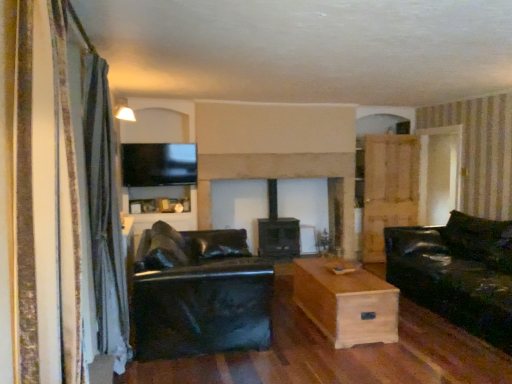
Question: Can you confirm if light brown wood armoire at right is smaller than gray fabric curtain at left, the first curtain viewed from the back?

Choices:
 (A) yes
 (B) no

Answer: (A)

Question: Is light brown wood armoire at right outside of gray fabric curtain at left, the 2th curtain positioned from the front?

Choices:
 (A) yes
 (B) no

Answer: (A)

Question: From the image's perspective, is light brown wood armoire at right below gray fabric curtain at left, which appears as the second curtain when viewed from the right?

Choices:
 (A) yes
 (B) no

Answer: (B)

Question: Is light brown wood armoire at right positioned with its back to gray fabric curtain at left, the 2th curtain positioned from the front?

Choices:
 (A) yes
 (B) no

Answer: (B)

Question: From a real-world perspective, does light brown wood armoire at right stand above gray fabric curtain at left, the first curtain viewed from the back?

Choices:
 (A) no
 (B) yes

Answer: (A)

Question: Considering the positions of point (444, 163) and point (380, 321), is point (444, 163) closer or farther from the camera than point (380, 321)?

Choices:
 (A) closer
 (B) farther

Answer: (B)

Question: Do you think transparent glass door at upper right is within light brown wood coffee table at center, or outside of it?

Choices:
 (A) inside
 (B) outside

Answer: (B)

Question: From the image's perspective, relative to light brown wood coffee table at center, is transparent glass door at upper right above or below?

Choices:
 (A) above
 (B) below

Answer: (A)

Question: In terms of height, does transparent glass door at upper right look taller or shorter compared to light brown wood coffee table at center?

Choices:
 (A) tall
 (B) short

Answer: (A)

Question: In terms of width, does light brown wood armoire at right look wider or thinner when compared to striped fabric curtain at left, which ranks as the second curtain in back-to-front order?

Choices:
 (A) wide
 (B) thin

Answer: (B)

Question: Is light brown wood armoire at right situated inside striped fabric curtain at left, placed as the 1th curtain when sorted from front to back, or outside?

Choices:
 (A) outside
 (B) inside

Answer: (A)

Question: From a real-world perspective, is light brown wood armoire at right above or below striped fabric curtain at left, positioned as the first curtain in right-to-left order?

Choices:
 (A) below
 (B) above

Answer: (A)

Question: Looking at the image, does light brown wood armoire at right seem bigger or smaller compared to striped fabric curtain at left, positioned as the first curtain in right-to-left order?

Choices:
 (A) big
 (B) small

Answer: (B)

Question: In the image, is light brown wood armoire at right positioned in front of or behind black leather couch at center, acting as the 1th studio couch starting from the left?

Choices:
 (A) behind
 (B) front

Answer: (A)

Question: From a real-world perspective, relative to black leather couch at center, acting as the 2th studio couch starting from the right, is light brown wood armoire at right vertically above or below?

Choices:
 (A) above
 (B) below

Answer: (A)